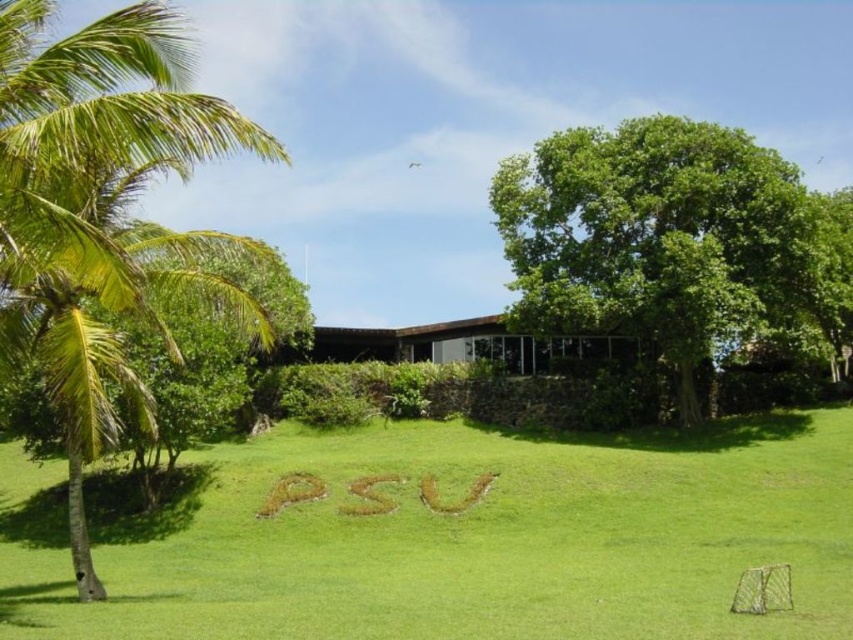
Question: Is green grass at center positioned in front of green leafy palm tree at left?

Choices:
 (A) no
 (B) yes

Answer: (A)

Question: Can you confirm if green grass at center is positioned below green leafy tree at upper right?

Choices:
 (A) yes
 (B) no

Answer: (A)

Question: Which object appears closest to the camera in this image?

Choices:
 (A) green leafy palm tree at left
 (B) green leafy tree at upper right
 (C) green grass at center

Answer: (A)

Question: Which of these objects is positioned farthest from the green leafy tree at upper right?

Choices:
 (A) green grass at center
 (B) green leafy palm tree at left

Answer: (B)

Question: Observing the image, what is the correct spatial positioning of green leafy palm tree at left in reference to green leafy tree at upper right?

Choices:
 (A) below
 (B) above

Answer: (A)

Question: Which point appears farthest from the camera in this image?

Choices:
 (A) (56, 276)
 (B) (705, 628)

Answer: (A)